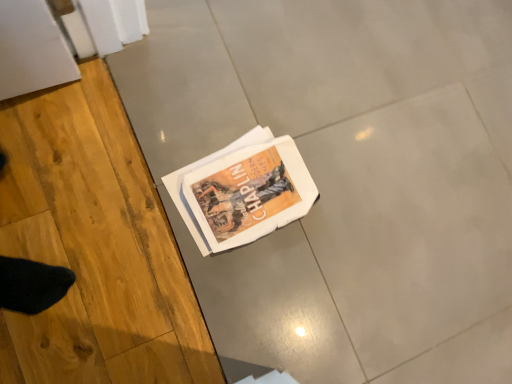
Identify the location of vacant space situated on the left part of orange paper magazine at center. This screenshot has height=384, width=512. (188, 104).